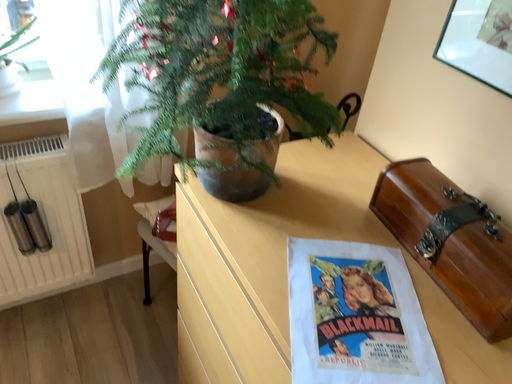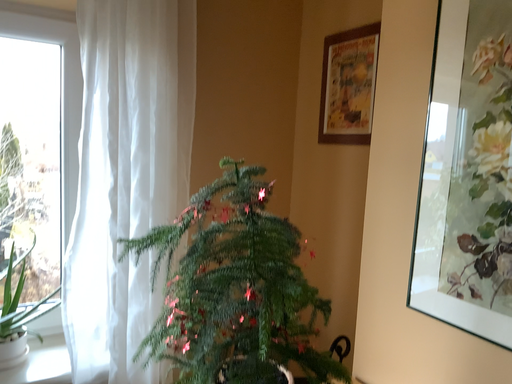
Question: How did the camera likely rotate when shooting the video?

Choices:
 (A) rotated downward
 (B) rotated upward

Answer: (B)